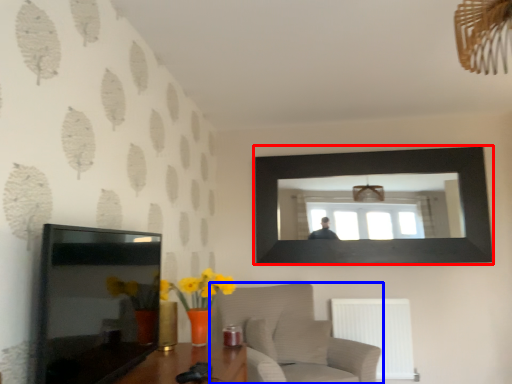
Question: Among these objects, which one is nearest to the camera, picture frame (highlighted by a red box) or furniture (highlighted by a blue box)?

Choices:
 (A) picture frame
 (B) furniture

Answer: (B)